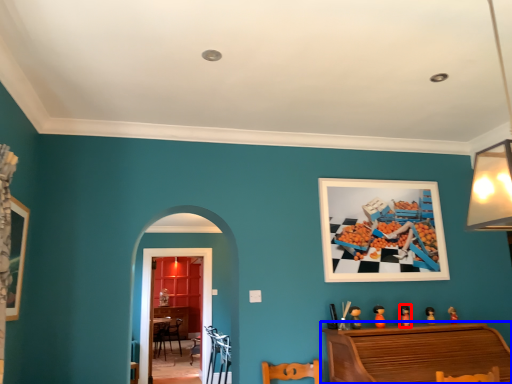
Question: Among these objects, which one is nearest to the camera, toy (highlighted by a red box) or furniture (highlighted by a blue box)?

Choices:
 (A) toy
 (B) furniture

Answer: (B)